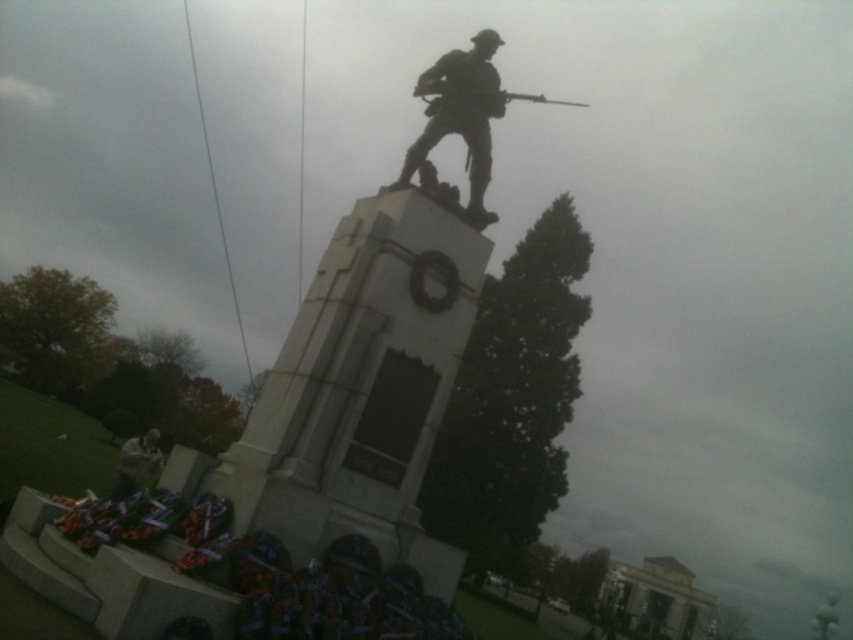
Question: From the image, what is the correct spatial relationship of polished bronze soldier at center in relation to shiny metallic rifle at upper center?

Choices:
 (A) left
 (B) right

Answer: (A)

Question: In this image, where is polished bronze soldier at center located relative to metallic silver helmet at lower left?

Choices:
 (A) left
 (B) right

Answer: (B)

Question: Which of the following is the closest to the observer?

Choices:
 (A) (442, 100)
 (B) (132, 445)

Answer: (A)

Question: Which point is farther to the camera?

Choices:
 (A) (459, 97)
 (B) (140, 460)

Answer: (B)

Question: Considering the real-world distances, which object is closest to the metallic silver helmet at lower left?

Choices:
 (A) shiny metallic rifle at upper center
 (B) polished bronze soldier at center

Answer: (B)

Question: Does polished bronze soldier at center appear under shiny metallic rifle at upper center?

Choices:
 (A) yes
 (B) no

Answer: (A)